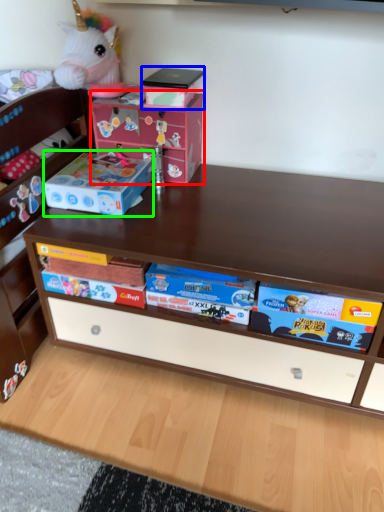
Question: Which object is positioned closest to cardboard box (highlighted by a red box)? Select from box (highlighted by a blue box) and storage box (highlighted by a green box).

Choices:
 (A) box
 (B) storage box

Answer: (A)